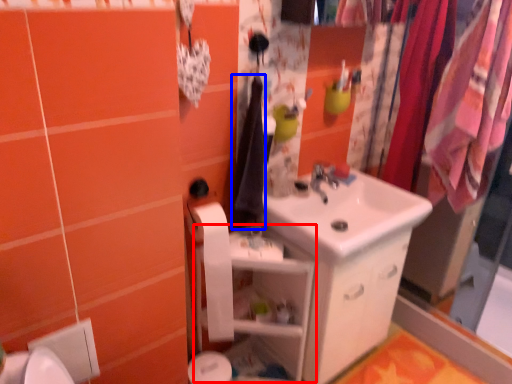
Question: Which of the following is the farthest to the observer, shelf (highlighted by a red box) or clothe (highlighted by a blue box)?

Choices:
 (A) shelf
 (B) clothe

Answer: (B)